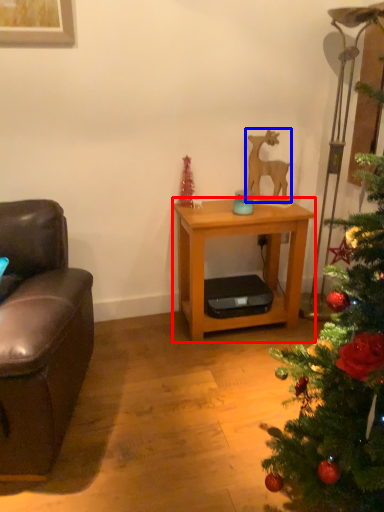
Question: Which point is further to the camera, desk (highlighted by a red box) or animal (highlighted by a blue box)?

Choices:
 (A) desk
 (B) animal

Answer: (B)